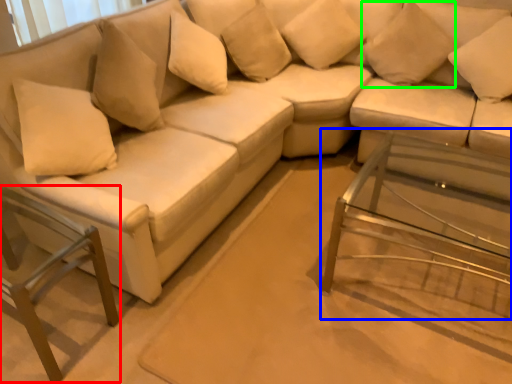
Question: Which is farther away from swivel chair (highlighted by a red box)? side table (highlighted by a blue box) or pillow (highlighted by a green box)?

Choices:
 (A) side table
 (B) pillow

Answer: (B)